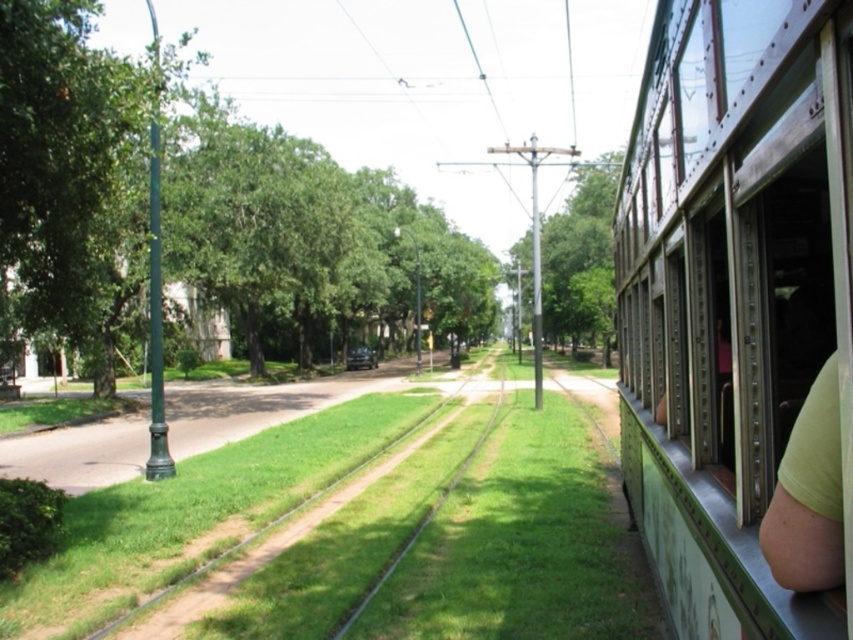
Question: Is green painted metal train at right wider than green fabric arm at right?

Choices:
 (A) yes
 (B) no

Answer: (B)

Question: Can you confirm if green painted metal train at right is positioned below green fabric arm at right?

Choices:
 (A) no
 (B) yes

Answer: (B)

Question: Does green painted metal train at right come behind green fabric arm at right?

Choices:
 (A) no
 (B) yes

Answer: (B)